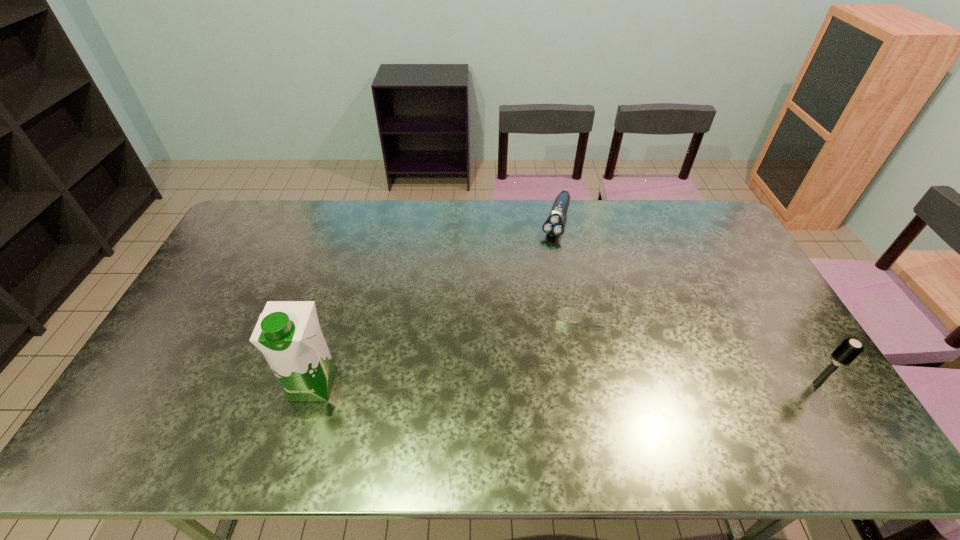
At what (x,y) coordinates should I click in order to perform the action: click on free region located on the front-facing side of the spectacles. Please return your answer as a coordinate pair (x, y). The width and height of the screenshot is (960, 540). Looking at the image, I should click on (587, 351).

The height and width of the screenshot is (540, 960). I want to click on vacant space located 0.230m on the front-facing side of the spectacles, so click(587, 395).

Identify the location of vacant space located 0.210m on the head of the third tallest object. This screenshot has width=960, height=540. (540, 279).

I want to click on vacant region located on the head of the third tallest object, so click(542, 272).

Identify the location of vacant area situated on the head of the third tallest object. Image resolution: width=960 pixels, height=540 pixels. (525, 322).

The image size is (960, 540). What are the coordinates of `object present at the far edge` in the screenshot? It's located at point(553,226).

Where is `soya milk that is at the near edge`? This screenshot has width=960, height=540. soya milk that is at the near edge is located at coordinates (288, 333).

Where is `hairbrush at the near edge`? hairbrush at the near edge is located at coordinates (x=849, y=349).

This screenshot has height=540, width=960. Identify the location of object situated at the right edge. pos(849,349).

Image resolution: width=960 pixels, height=540 pixels. Identify the location of object that is at the near right corner. (849, 349).